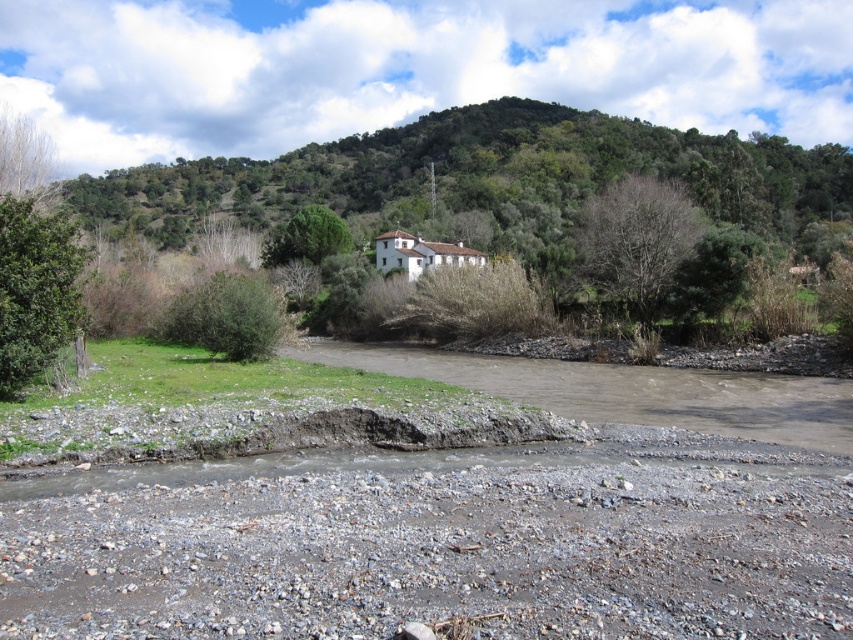
You are standing at the riverbank and see the green leafy bush at lower left and the green leafy tree at upper center. Which one is closer to you?

The green leafy bush at lower left is closer to you because it is positioned in front of the green leafy tree at upper center.

You are an artist sketching the landscape and want to ensure the proportions between the bare branches at upper right and the green leafy tree at upper left are accurate. Which one should you draw wider?

The bare branches at upper right should be drawn wider since its width is larger than the green leafy tree at upper left.

Consider the image. You are standing at the riverbank in the image and want to reach a specific location marked by the point at coordinates point (45, 278). If your walking speed is 1.5 meters per second, how many seconds will it take you to reach that point?

The point at coordinates point (45, 278) is 19.28 meters away from the viewer. At a walking speed of 1.5 meters per second, it would take approximately 12.85 seconds to reach the point. Since the question asks for the time in seconds, rounding to the nearest whole number gives about 13 seconds.